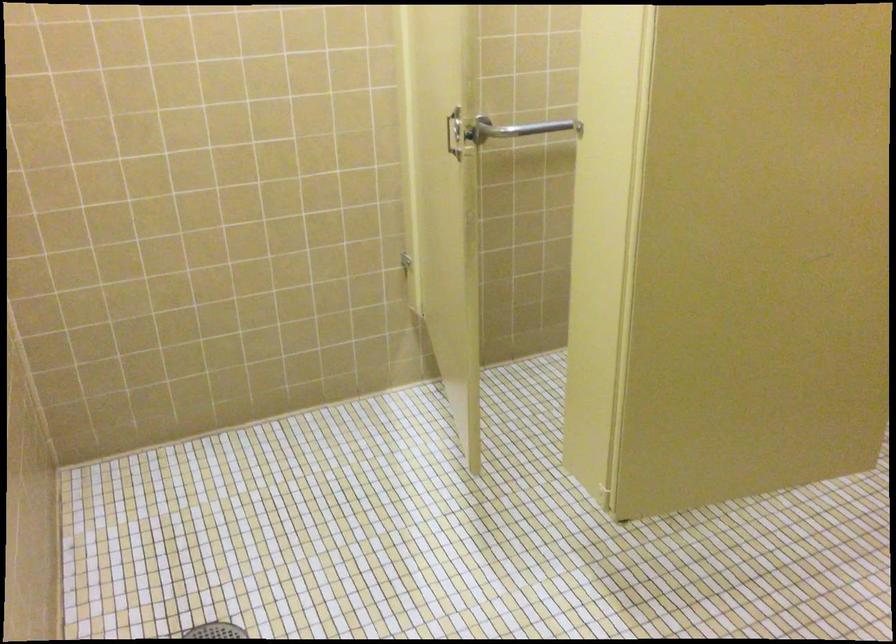
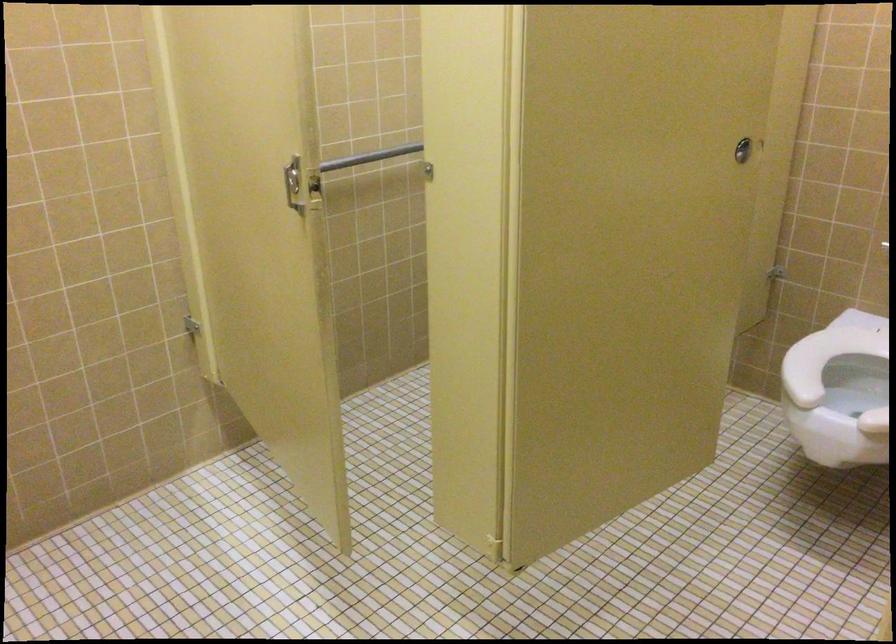
The point at (453, 126) is marked in the first image. Where is the corresponding point in the second image?

(293, 184)